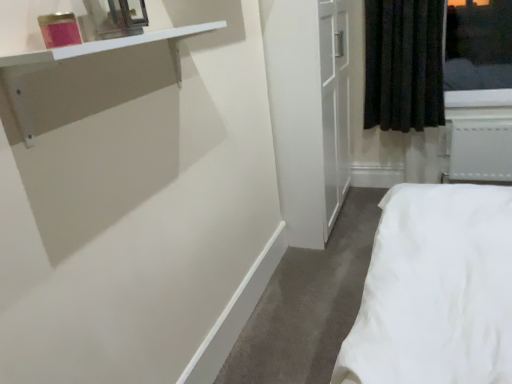
Question: Is white glossy shelf at upper left shorter than metallic mirror at upper left?

Choices:
 (A) yes
 (B) no

Answer: (A)

Question: Is white glossy shelf at upper left at the right side of metallic mirror at upper left?

Choices:
 (A) no
 (B) yes

Answer: (B)

Question: From the image's perspective, is white glossy shelf at upper left below metallic mirror at upper left?

Choices:
 (A) yes
 (B) no

Answer: (A)

Question: Is white glossy shelf at upper left to the left of metallic mirror at upper left from the viewer's perspective?

Choices:
 (A) no
 (B) yes

Answer: (A)

Question: Can you confirm if white glossy shelf at upper left is taller than metallic mirror at upper left?

Choices:
 (A) no
 (B) yes

Answer: (A)

Question: Is white glossy shelf at upper left further to the viewer compared to metallic mirror at upper left?

Choices:
 (A) yes
 (B) no

Answer: (B)

Question: Could you tell me if white plastic radiator at lower right is facing white glossy shelf at upper left?

Choices:
 (A) no
 (B) yes

Answer: (B)

Question: Does white plastic radiator at lower right have a greater height compared to white glossy shelf at upper left?

Choices:
 (A) no
 (B) yes

Answer: (B)

Question: Is white plastic radiator at lower right positioned beyond the bounds of white glossy shelf at upper left?

Choices:
 (A) no
 (B) yes

Answer: (B)

Question: Would you say white plastic radiator at lower right contains white glossy shelf at upper left?

Choices:
 (A) yes
 (B) no

Answer: (B)

Question: Considering the relative positions of white plastic radiator at lower right and white glossy shelf at upper left in the image provided, is white plastic radiator at lower right in front of white glossy shelf at upper left?

Choices:
 (A) no
 (B) yes

Answer: (A)

Question: From a real-world perspective, is white plastic radiator at lower right on top of white glossy shelf at upper left?

Choices:
 (A) no
 (B) yes

Answer: (A)

Question: Does black fabric curtain at upper right come in front of white plastic radiator at lower right?

Choices:
 (A) no
 (B) yes

Answer: (B)